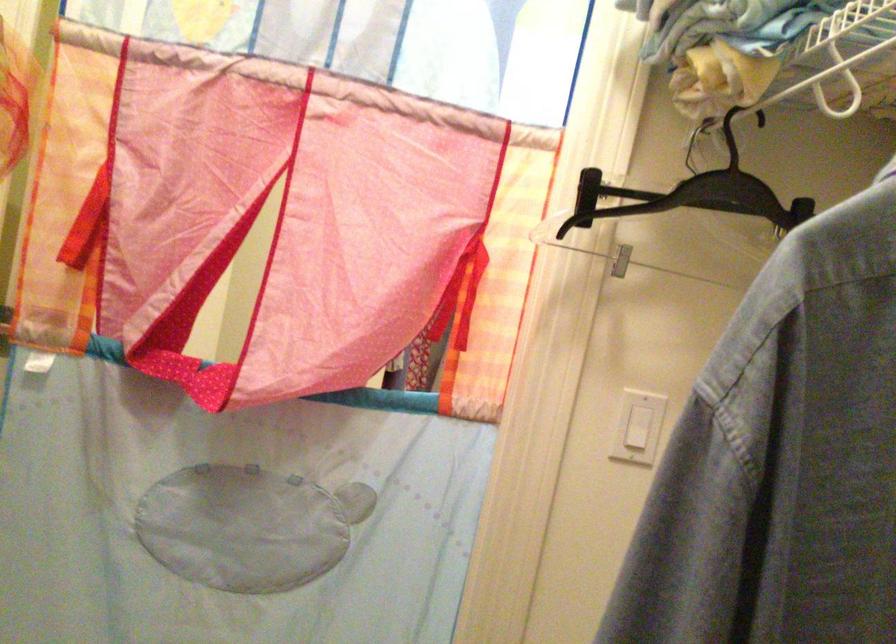
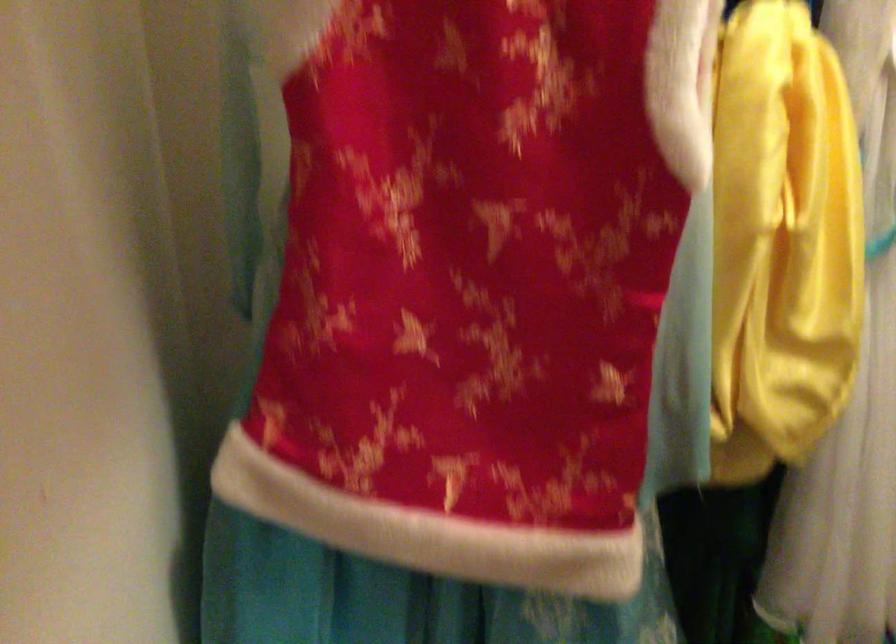
Question: The first image is from the beginning of the video and the second image is from the end. How did the camera likely rotate when shooting the video?

Choices:
 (A) Left
 (B) Right
 (C) Up
 (D) Down

Answer: (A)